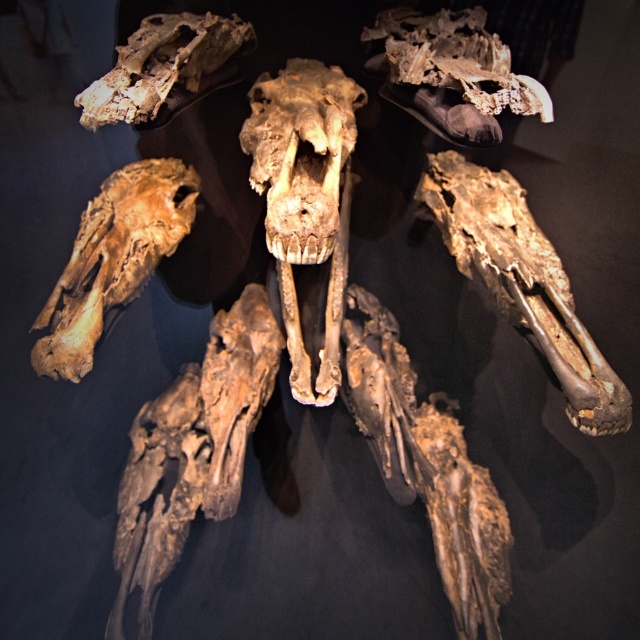
Question: Does brown/weathered bone skull at center have a greater width compared to brown fossilized skull at lower right?

Choices:
 (A) no
 (B) yes

Answer: (A)

Question: Is brown/weathered bone skull at center to the left of brown rough bone at center from the viewer's perspective?

Choices:
 (A) no
 (B) yes

Answer: (A)

Question: Does brown rough bone at center have a larger size compared to brown fossilized skull at upper left?

Choices:
 (A) no
 (B) yes

Answer: (B)

Question: Which object is closer to the camera taking this photo?

Choices:
 (A) brown fossilized skull at upper left
 (B) brown/weathered bone skull at center

Answer: (B)

Question: Which object is the closest to the brown/weathered bone skull at center?

Choices:
 (A) brown rough bone at center
 (B) brown fossilized skull at upper left
 (C) brown fossilized skull at lower right

Answer: (B)

Question: Which point appears farthest from the camera in this image?

Choices:
 (A) (314, 216)
 (B) (595, 429)

Answer: (B)